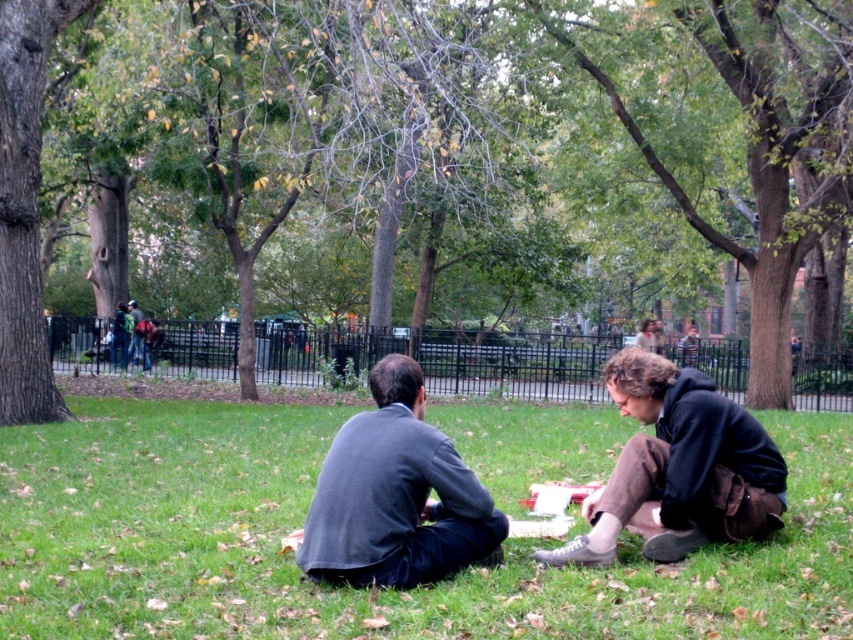
Does brown textured tree at center appear on the right side of dark gray sweater at center?

Indeed, brown textured tree at center is positioned on the right side of dark gray sweater at center.

Between brown textured tree at center and dark gray sweater at center, which one appears on the left side from the viewer's perspective?

dark gray sweater at center

Between point (218, 262) and point (383, 545), which one is positioned in front?

Point (383, 545)

What are the coordinates of `brown textured tree at center` in the screenshot? It's located at (445, 163).

Who is shorter, dark gray sweater at center or dark brown hoodie at lower right?

With less height is dark brown hoodie at lower right.

Can you confirm if dark gray sweater at center is positioned to the right of dark brown hoodie at lower right?

No, dark gray sweater at center is not to the right of dark brown hoodie at lower right.

Between point (397, 476) and point (711, 381), which one is positioned behind?

Positioned behind is point (711, 381).

Find the location of a particular element. Image resolution: width=853 pixels, height=640 pixels. dark gray sweater at center is located at coordinates (396, 496).

Does green grass at center have a smaller size compared to dark gray sweater at center?

No, green grass at center is not smaller than dark gray sweater at center.

The width and height of the screenshot is (853, 640). I want to click on green grass at center, so click(x=364, y=588).